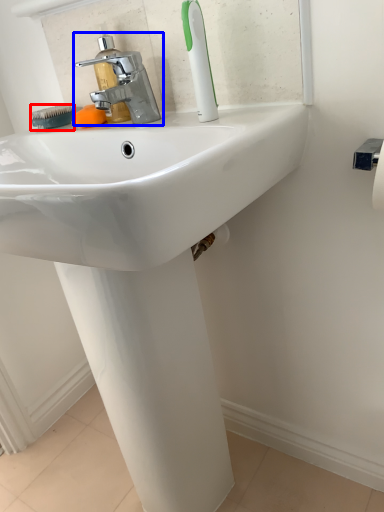
Question: Among these objects, which one is farthest to the camera, brush (highlighted by a red box) or tap (highlighted by a blue box)?

Choices:
 (A) brush
 (B) tap

Answer: (A)